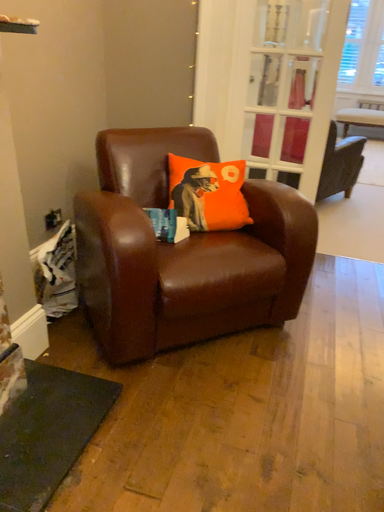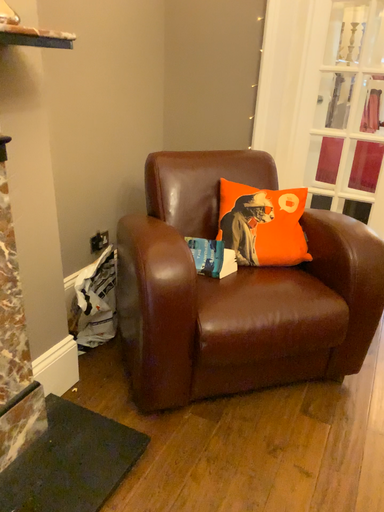
Question: How did the camera likely rotate when shooting the video?

Choices:
 (A) rotated right
 (B) rotated left

Answer: (B)